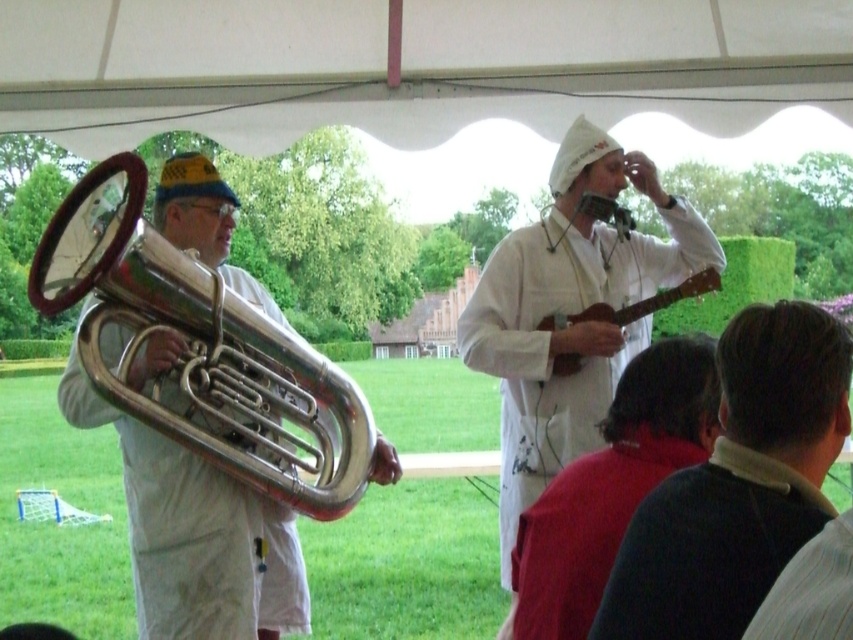
Is polished silver trumpet at left shorter than wooden acoustic guitar at center?

No.

Between polished silver trumpet at left and wooden acoustic guitar at center, which one appears on the right side from the viewer's perspective?

wooden acoustic guitar at center

You are a GUI agent. You are given a task and a screenshot of the screen. Output one action in this format:
    pyautogui.click(x=<x>, y=<y>)
    Task: Click on the polished silver trumpet at left
    The width and height of the screenshot is (853, 640).
    Given the screenshot: What is the action you would take?
    pyautogui.click(x=199, y=348)

The width and height of the screenshot is (853, 640). What are the coordinates of `polished silver trumpet at left` in the screenshot? It's located at (199, 348).

Is point (676, 528) behind point (537, 371)?

No, it is not.

Is dark blue sweater at lower right to the left of white matte guitar at upper center from the viewer's perspective?

In fact, dark blue sweater at lower right is to the right of white matte guitar at upper center.

Find the location of a particular element. The height and width of the screenshot is (640, 853). dark blue sweater at lower right is located at coordinates (738, 483).

Is polished silver trumpet at left smaller than dark blue sweater at lower right?

Actually, polished silver trumpet at left might be larger than dark blue sweater at lower right.

Which is below, polished silver trumpet at left or dark blue sweater at lower right?

dark blue sweater at lower right is below.

Is point (223, 390) positioned in front of point (820, 436)?

That is False.

This screenshot has height=640, width=853. I want to click on polished silver trumpet at left, so click(199, 348).